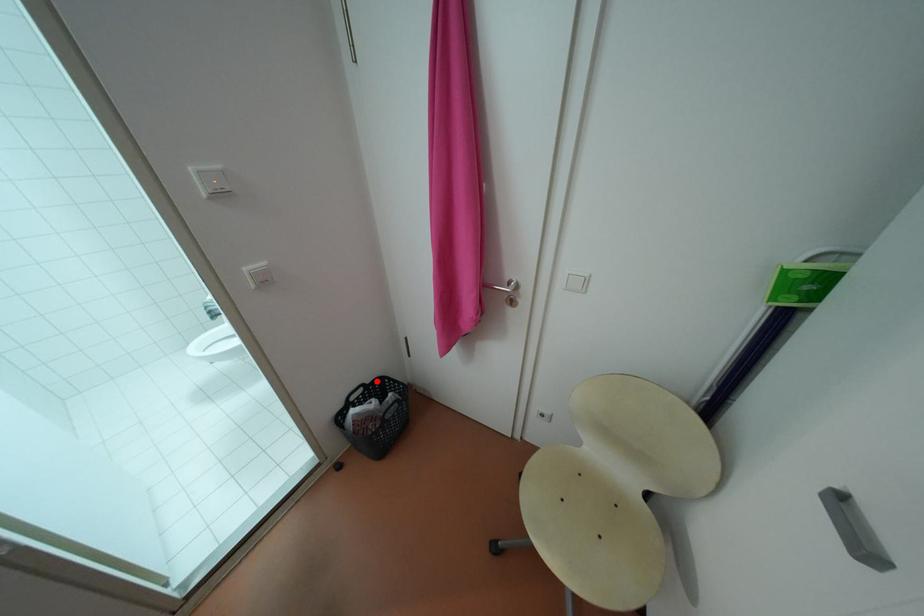
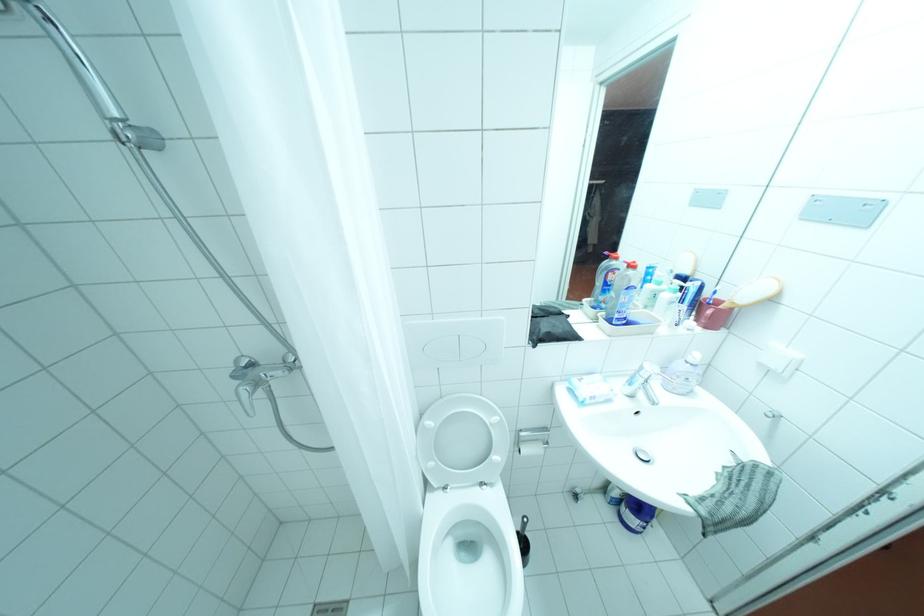
Question: I am providing you with two images of the same scene from different viewpoints. A red point is marked on the first image. Can you still see the location of the red point in image 2?

Choices:
 (A) Yes
 (B) No

Answer: (B)